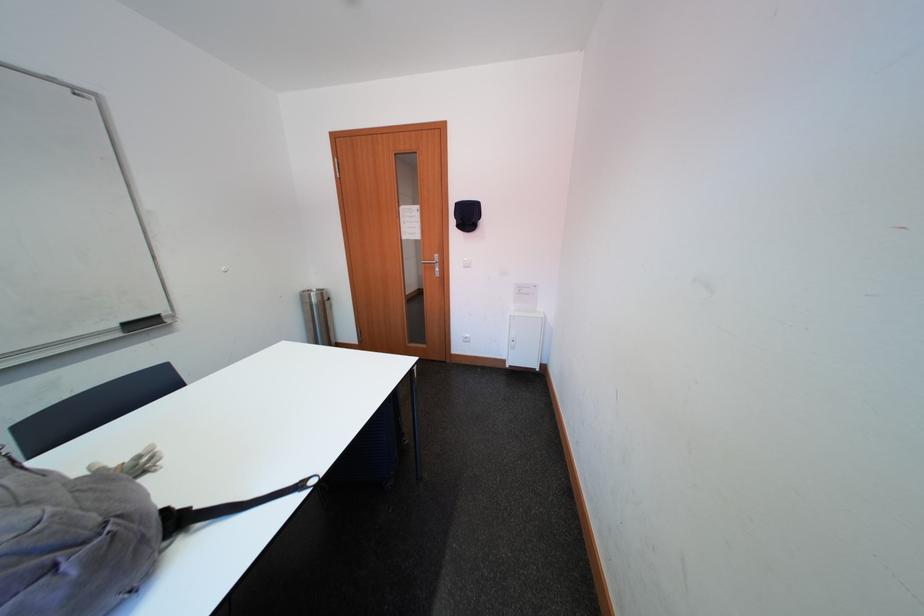
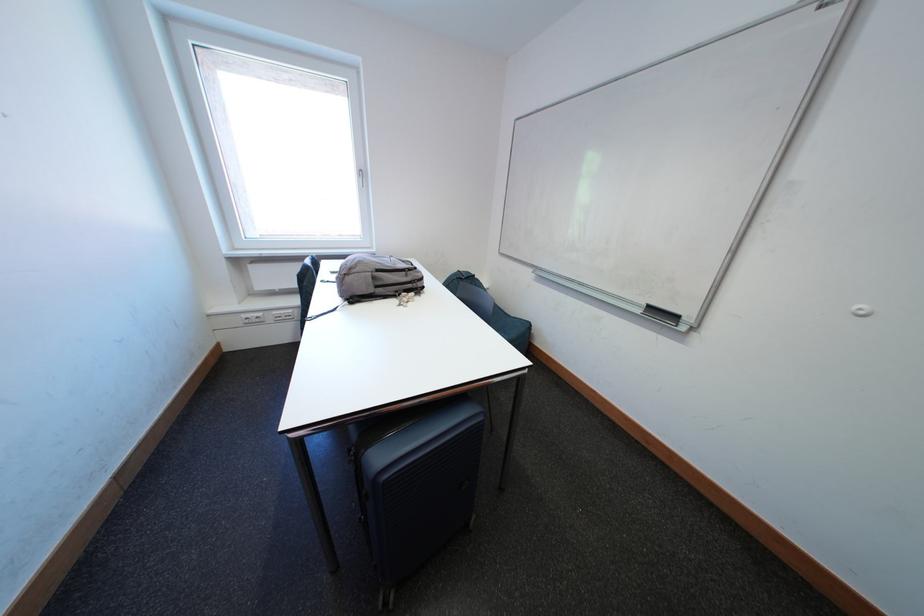
Find the pixel in the second image that matches point (128, 338) in the first image.

(649, 315)